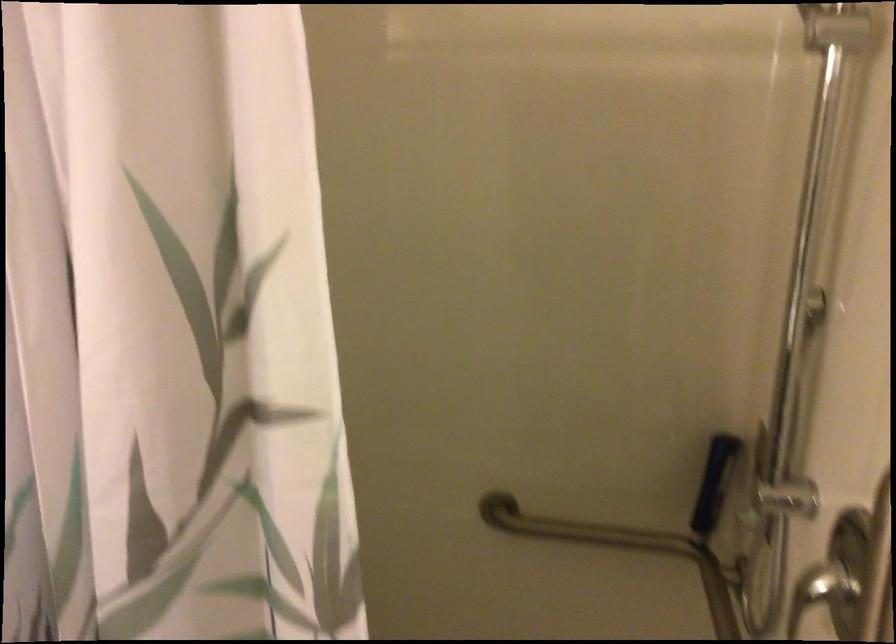
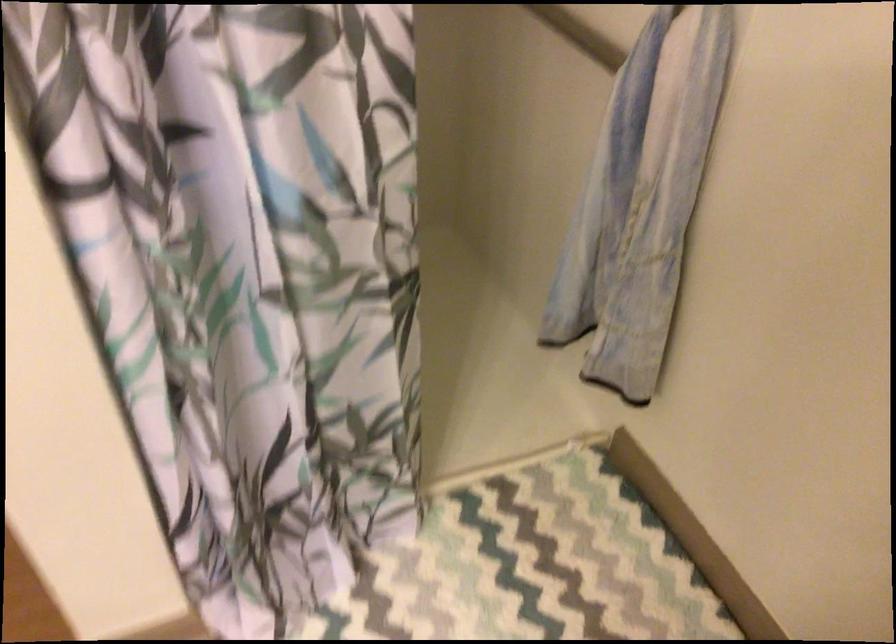
First-person continuous shooting, in which direction is the camera rotating?

The camera's rotation is toward right-down.